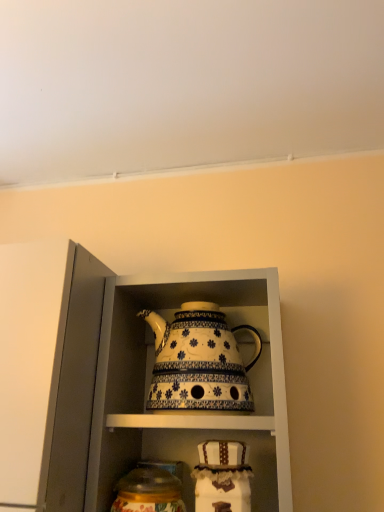
Identify the location of matte glass jar at lower center. This screenshot has height=512, width=384. (148, 490).

The width and height of the screenshot is (384, 512). Identify the location of white ceramic teapot at center. (199, 361).

The image size is (384, 512). Identify the location of white glossy teapot at center. (120, 378).

From the image's perspective, is white ceramic teapot at center above or below white glossy teapot at center?

From the image's perspective, white ceramic teapot at center appears above white glossy teapot at center.

Between white ceramic teapot at center and white glossy teapot at center, which one has smaller width?

white ceramic teapot at center.

Is white glossy teapot at center completely or partially inside white ceramic teapot at center?

No, white glossy teapot at center is not inside white ceramic teapot at center.

Which is behind, white ceramic teapot at center or white glossy teapot at center?

white ceramic teapot at center is behind.

From the image's perspective, which one is positioned lower, white glossy teapot at center or matte glass jar at lower center?

matte glass jar at lower center is shown below in the image.

Considering the positions of points (167, 438) and (129, 486), is point (167, 438) closer to camera compared to point (129, 486)?

No, it is behind (129, 486).

Considering the relative positions of white glossy teapot at center and matte glass jar at lower center in the image provided, is white glossy teapot at center to the left of matte glass jar at lower center from the viewer's perspective?

No, white glossy teapot at center is not to the left of matte glass jar at lower center.

Consider the image. Considering the sizes of white glossy teapot at center and matte glass jar at lower center in the image, is white glossy teapot at center wider or thinner than matte glass jar at lower center?

Considering their sizes, white glossy teapot at center looks broader than matte glass jar at lower center.

From the image's perspective, relative to white ceramic teapot at center, is matte glass jar at lower center above or below?

matte glass jar at lower center is situated lower than white ceramic teapot at center in the image.

Would you say matte glass jar at lower center is outside white ceramic teapot at center?

matte glass jar at lower center lies outside white ceramic teapot at center's area.

Considering their positions, is matte glass jar at lower center located in front of or behind white ceramic teapot at center?

Visually, matte glass jar at lower center is located in front of white ceramic teapot at center.

How many degrees apart are the facing directions of matte glass jar at lower center and white ceramic teapot at center?

The angle between the facing direction of matte glass jar at lower center and the facing direction of white ceramic teapot at center is 0.000546 degrees.

Is point (229, 389) less distant than point (143, 477)?

Yes.

From the picture: Is white ceramic teapot at center completely or partially outside of matte glass jar at lower center?

Absolutely, white ceramic teapot at center is external to matte glass jar at lower center.

From the image's perspective, which object appears higher, white glossy teapot at center or white ceramic teapot at center?

white ceramic teapot at center, from the image's perspective.

From a real-world perspective, is white glossy teapot at center physically below white ceramic teapot at center?

Yes, from a real-world perspective, white glossy teapot at center is below white ceramic teapot at center.

Is white ceramic teapot at center a part of white glossy teapot at center?

Absolutely, white ceramic teapot at center is inside white glossy teapot at center.

Considering the sizes of objects white glossy teapot at center and white ceramic teapot at center in the image provided, who is wider, white glossy teapot at center or white ceramic teapot at center?

white glossy teapot at center is wider.

Which object is more forward, matte glass jar at lower center or white glossy teapot at center?

Positioned in front is white glossy teapot at center.

Is white glossy teapot at center at the back of matte glass jar at lower center?

Yes, matte glass jar at lower center is facing away from white glossy teapot at center.

Consider the image. From the image's perspective, which one is positioned lower, matte glass jar at lower center or white glossy teapot at center?

matte glass jar at lower center appears lower in the image.

Based on their sizes in the image, would you say matte glass jar at lower center is bigger or smaller than white glossy teapot at center?

matte glass jar at lower center is smaller than white glossy teapot at center.

You are a GUI agent. You are given a task and a screenshot of the screen. Output one action in this format:
    pyautogui.click(x=<x>, y=<y>)
    Task: Click on the cabinetry that is in front of the white ceramic teapot at center
    The width and height of the screenshot is (384, 512).
    Given the screenshot: What is the action you would take?
    pyautogui.click(x=120, y=378)

Find the location of a particular element. The image size is (384, 512). tableware on the left of white glossy teapot at center is located at coordinates (148, 490).

Based on their spatial positions, is white ceramic teapot at center or matte glass jar at lower center closer to white glossy teapot at center?

white ceramic teapot at center lies closer to white glossy teapot at center than the other object.

Estimate the real-world distances between objects in this image. Which object is closer to white glossy teapot at center, matte glass jar at lower center or white ceramic teapot at center?

white ceramic teapot at center.

Consider the image. Looking at the image, which one is located further to white ceramic teapot at center, matte glass jar at lower center or white glossy teapot at center?

matte glass jar at lower center.

Based on the photo, looking at the image, which one is located further to white ceramic teapot at center, white glossy teapot at center or matte glass jar at lower center?

The object further to white ceramic teapot at center is matte glass jar at lower center.

Based on their spatial positions, is white ceramic teapot at center or white glossy teapot at center closer to matte glass jar at lower center?

white ceramic teapot at center lies closer to matte glass jar at lower center than the other object.

Estimate the real-world distances between objects in this image. Which object is further from matte glass jar at lower center, white glossy teapot at center or white ceramic teapot at center?

white glossy teapot at center.

Where is `cabinetry that lies between white ceramic teapot at center and matte glass jar at lower center from top to bottom`? This screenshot has width=384, height=512. cabinetry that lies between white ceramic teapot at center and matte glass jar at lower center from top to bottom is located at coordinates (120, 378).